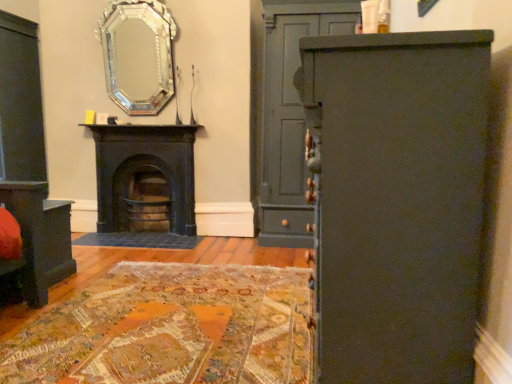
At what (x,y) coordinates should I click in order to perform the action: click on black cast iron fireplace at center. Please return your answer as a coordinate pair (x, y). Looking at the image, I should click on (144, 166).

What do you see at coordinates (396, 201) in the screenshot?
I see `matte black cabinet at right` at bounding box center [396, 201].

I want to click on matte black cabinet at right, so click(396, 201).

Where is `black cast iron fireplace at center`? This screenshot has height=384, width=512. black cast iron fireplace at center is located at coordinates (144, 166).

Could black cast iron fireplace at center be considered to be inside matte black cabinet at right?

Actually, black cast iron fireplace at center is outside matte black cabinet at right.

Is matte black cabinet at right further to the viewer compared to black cast iron fireplace at center?

No, matte black cabinet at right is closer to the viewer.

Does matte black cabinet at right have a larger size compared to black cast iron fireplace at center?

Yes.

Considering the relative sizes of matte black cabinet at right and black cast iron fireplace at center in the image provided, is matte black cabinet at right shorter than black cast iron fireplace at center?

No.

Considering the points (131, 101) and (25, 203), which point is behind, point (131, 101) or point (25, 203)?

The point (131, 101) is more distant.

Which of these two, silver/glass mirror at upper center or matte black vanity at lower left, stands shorter?

With less height is matte black vanity at lower left.

Is the position of silver/glass mirror at upper center more distant than that of matte black vanity at lower left?

Yes, silver/glass mirror at upper center is further from the camera.

How much distance is there between silver/glass mirror at upper center and matte black vanity at lower left?

silver/glass mirror at upper center and matte black vanity at lower left are 1.71 meters apart.

Which point is more distant from viewer, (x=274, y=88) or (x=153, y=57)?

The point (x=153, y=57) is behind.

Who is shorter, matte gray cabinet at right or silver/glass mirror at upper center?

silver/glass mirror at upper center.

Looking at this image, which is in front, matte gray cabinet at right or silver/glass mirror at upper center?

matte gray cabinet at right is closer to the camera.

From a real-world perspective, between matte gray cabinet at right and silver/glass mirror at upper center, who is vertically lower?

From a 3D spatial view, matte gray cabinet at right is below.

From a real-world perspective, which object stands above the other?

silver/glass mirror at upper center is physically above.

In terms of width, does silver/glass mirror at upper center look wider or thinner when compared to black cast iron fireplace at center?

In the image, silver/glass mirror at upper center appears to be more narrow than black cast iron fireplace at center.

Is silver/glass mirror at upper center facing towards black cast iron fireplace at center?

No, silver/glass mirror at upper center is not turned towards black cast iron fireplace at center.

Can you confirm if silver/glass mirror at upper center is shorter than matte black cabinet at right?

Correct, silver/glass mirror at upper center is not as tall as matte black cabinet at right.

How distant is silver/glass mirror at upper center from matte black cabinet at right?

A distance of 2.85 meters exists between silver/glass mirror at upper center and matte black cabinet at right.

Which object is further away from the camera, silver/glass mirror at upper center or matte black cabinet at right?

silver/glass mirror at upper center is further away from the camera.

In the image, is silver/glass mirror at upper center on the left side or the right side of matte black cabinet at right?

Clearly, silver/glass mirror at upper center is on the left of matte black cabinet at right in the image.

The width and height of the screenshot is (512, 384). I want to click on mirror lying above the matte gray cabinet at right (from the image's perspective), so click(138, 55).

From a real-world perspective, is silver/glass mirror at upper center positioned over matte gray cabinet at right based on gravity?

Yes, from a real-world perspective, silver/glass mirror at upper center is on top of matte gray cabinet at right.

From the image's perspective, which object appears higher, silver/glass mirror at upper center or matte gray cabinet at right?

From the image's view, silver/glass mirror at upper center is above.

Based on their positions, is silver/glass mirror at upper center located to the left or right of matte gray cabinet at right?

silver/glass mirror at upper center is to the left of matte gray cabinet at right.

Find the location of a particular element. The image size is (512, 384). mirror above the black cast iron fireplace at center (from the image's perspective) is located at coordinates (138, 55).

Can you confirm if black cast iron fireplace at center is bigger than silver/glass mirror at upper center?

Yes, black cast iron fireplace at center is bigger than silver/glass mirror at upper center.

From a real-world perspective, which object rests below the other?

In real-world perspective, black cast iron fireplace at center is lower.

Is black cast iron fireplace at center closer to camera compared to silver/glass mirror at upper center?

No, the depth of black cast iron fireplace at center is greater than that of silver/glass mirror at upper center.

Where is `fireplace above the matte black cabinet at right (from the image's perspective)`? Image resolution: width=512 pixels, height=384 pixels. fireplace above the matte black cabinet at right (from the image's perspective) is located at coordinates (144, 166).

Identify the location of vanity in front of the silver/glass mirror at upper center. The height and width of the screenshot is (384, 512). (38, 239).

Which object lies further to the anchor point black cast iron fireplace at center, silver/glass mirror at upper center or matte gray cabinet at right?

matte gray cabinet at right is positioned further to the anchor black cast iron fireplace at center.

Estimate the real-world distances between objects in this image. Which object is further from black cast iron fireplace at center, silver/glass mirror at upper center or matte black vanity at lower left?

matte black vanity at lower left is positioned further to the anchor black cast iron fireplace at center.

Looking at the image, which one is located further to matte black vanity at lower left, silver/glass mirror at upper center or matte black cabinet at right?

Among the two, matte black cabinet at right is located further to matte black vanity at lower left.

Based on their spatial positions, is black cast iron fireplace at center or matte gray cabinet at right closer to matte black cabinet at right?

matte gray cabinet at right lies closer to matte black cabinet at right than the other object.

Based on their spatial positions, is matte black vanity at lower left or silver/glass mirror at upper center further from matte gray cabinet at right?

matte black vanity at lower left.

Based on their spatial positions, is black cast iron fireplace at center or matte black cabinet at right further from silver/glass mirror at upper center?

Among the two, matte black cabinet at right is located further to silver/glass mirror at upper center.

When comparing their distances from matte black cabinet at right, does black cast iron fireplace at center or matte black vanity at lower left seem further?

black cast iron fireplace at center lies further to matte black cabinet at right than the other object.

Estimate the real-world distances between objects in this image. Which object is further from silver/glass mirror at upper center, matte black vanity at lower left or matte black cabinet at right?

The object further to silver/glass mirror at upper center is matte black cabinet at right.

Identify the location of fireplace between matte black vanity at lower left and matte gray cabinet at right in the horizontal direction. (144, 166).

I want to click on mirror positioned between matte black vanity at lower left and black cast iron fireplace at center from near to far, so click(x=138, y=55).

Find the location of `vanity located between matte black cabinet at right and black cast iron fireplace at center in the depth direction`. vanity located between matte black cabinet at right and black cast iron fireplace at center in the depth direction is located at coordinates (38, 239).

This screenshot has height=384, width=512. I want to click on door between matte black cabinet at right and silver/glass mirror at upper center in the front-back direction, so click(290, 114).